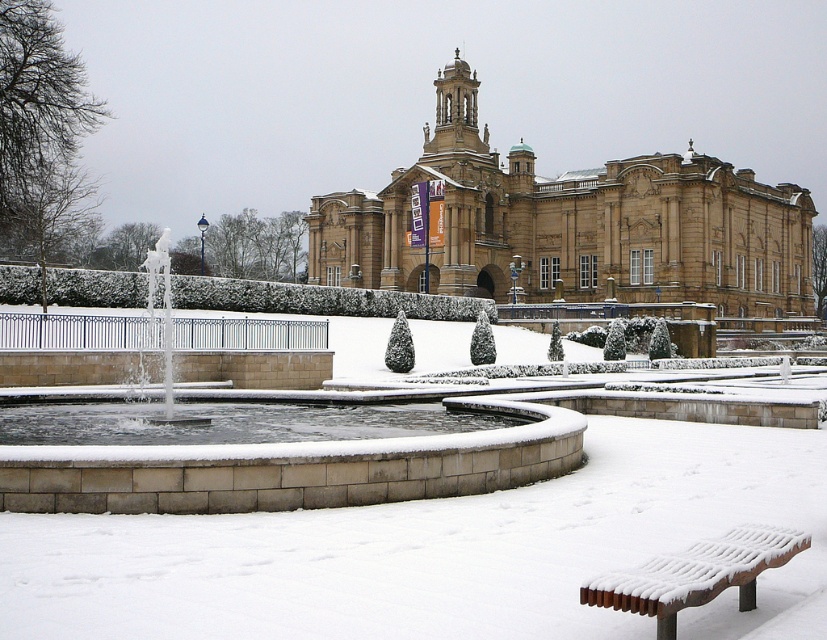
Question: Can you confirm if white stone fountain at center is wider than snow-covered wooden bench at lower right?

Choices:
 (A) yes
 (B) no

Answer: (A)

Question: Which point is closer to the camera?

Choices:
 (A) snow-covered wooden bench at lower right
 (B) white stone fountain at center

Answer: (A)

Question: Which of the following is the closest to the observer?

Choices:
 (A) beige stone building at center
 (B) white stone fountain at center

Answer: (B)

Question: Can you confirm if beige stone building at center is thinner than snow-covered wooden bench at lower right?

Choices:
 (A) no
 (B) yes

Answer: (A)

Question: Can you confirm if beige stone building at center is smaller than white stone fountain at center?

Choices:
 (A) yes
 (B) no

Answer: (B)

Question: Among these points, which one is farthest from the camera?

Choices:
 (A) (625, 589)
 (B) (318, 465)
 (C) (748, 262)

Answer: (C)